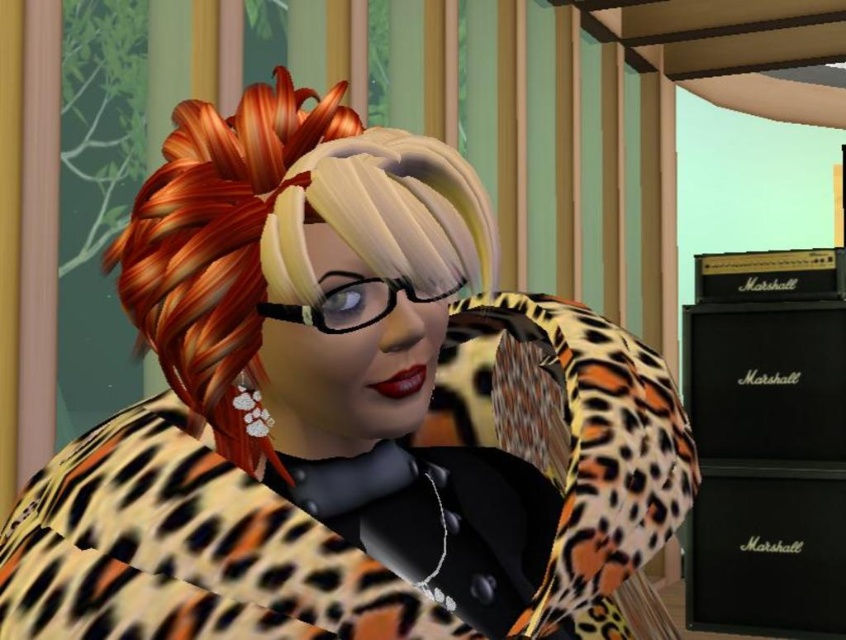
Question: Which of the following is the farthest from the observer?

Choices:
 (A) (154, 212)
 (B) (339, 172)

Answer: (A)

Question: Which of the following is the closest to the observer?

Choices:
 (A) leopard print coat at center
 (B) leopard print hair at center

Answer: (A)

Question: Considering the relative positions of leopard print coat at center and leopard print hair at center in the image provided, where is leopard print coat at center located with respect to leopard print hair at center?

Choices:
 (A) below
 (B) above

Answer: (A)

Question: Which point is closer to the camera?

Choices:
 (A) leopard print hair at center
 (B) leopard print coat at center

Answer: (B)

Question: Considering the relative positions of leopard print coat at center and leopard print hair at center in the image provided, where is leopard print coat at center located with respect to leopard print hair at center?

Choices:
 (A) right
 (B) left

Answer: (A)

Question: Is leopard print coat at center positioned before leopard print hair at center?

Choices:
 (A) no
 (B) yes

Answer: (B)